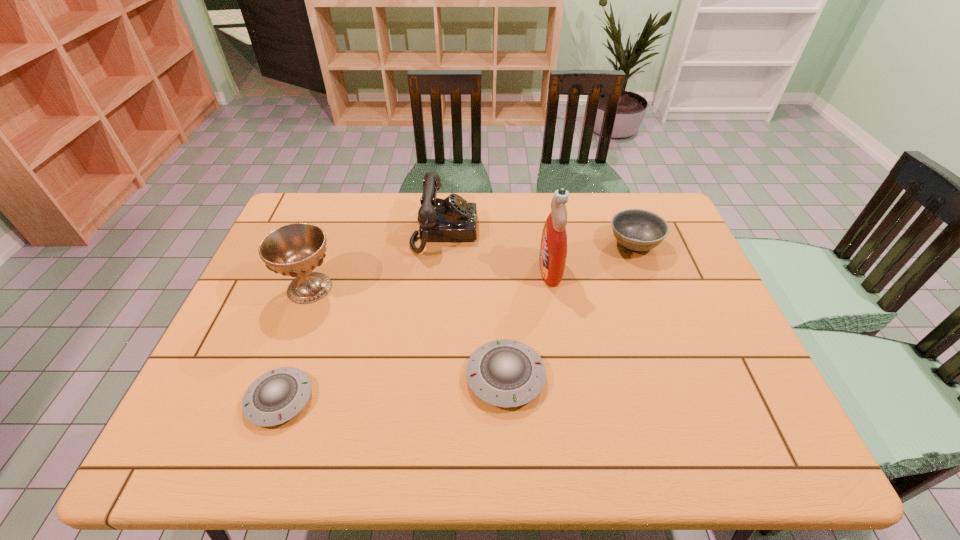
Locate an element on the screen. The image size is (960, 540). free space located 0.200m on the back of the shorter saucer is located at coordinates (312, 308).

Identify the location of free space located on the left of the second shortest object. This screenshot has height=540, width=960. (428, 376).

Find the location of `vacant space located on the dial of the telephone`. vacant space located on the dial of the telephone is located at coordinates (586, 231).

The width and height of the screenshot is (960, 540). What are the coordinates of `free space located on the left of the bowl` in the screenshot? It's located at (585, 244).

The height and width of the screenshot is (540, 960). Identify the location of free region located 0.170m on the front surface of the fifth object from left to right. (481, 269).

Where is `free space located 0.310m on the front surface of the fifth object from left to right`? free space located 0.310m on the front surface of the fifth object from left to right is located at coordinates (433, 269).

Locate an element on the screen. Image resolution: width=960 pixels, height=540 pixels. free region located on the front surface of the fifth object from left to right is located at coordinates (494, 269).

At what (x,y) coordinates should I click in order to perform the action: click on vacant space located 0.220m on the right of the chalice. Please return your answer as a coordinate pair (x, y). Looking at the image, I should click on (417, 288).

Locate an element on the screen. This screenshot has width=960, height=540. telephone that is at the far edge is located at coordinates (451, 219).

The height and width of the screenshot is (540, 960). Identify the location of bowl located in the far edge section of the desktop. (637, 230).